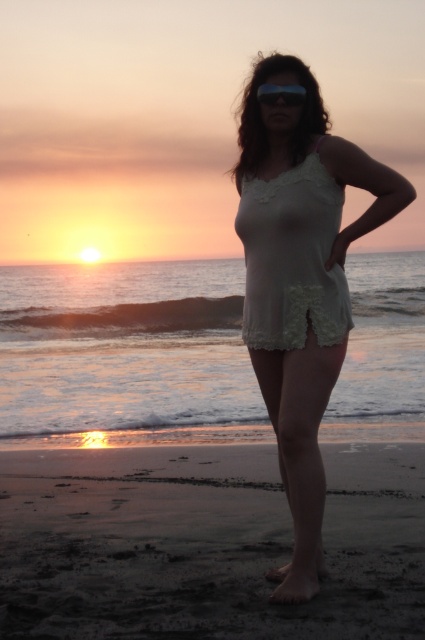
Question: In this image, where is white lace top at center located relative to transparent plastic goggles at center?

Choices:
 (A) above
 (B) below

Answer: (B)

Question: Which of the following is the farthest from the observer?

Choices:
 (A) white lace dress at center
 (B) transparent plastic goggles at center
 (C) white lace top at center
 (D) sandy beach at lower center

Answer: (B)

Question: Which point is farther to the camera?

Choices:
 (A) (325, 456)
 (B) (294, 260)

Answer: (A)

Question: From the image, what is the correct spatial relationship of white lace top at center in relation to white lace dress at center?

Choices:
 (A) below
 (B) above

Answer: (A)

Question: Among these objects, which one is nearest to the camera?

Choices:
 (A) white lace top at center
 (B) white lace dress at center
 (C) sandy beach at lower center
 (D) transparent plastic goggles at center

Answer: (C)

Question: Is white lace top at center positioned behind white lace dress at center?

Choices:
 (A) no
 (B) yes

Answer: (A)